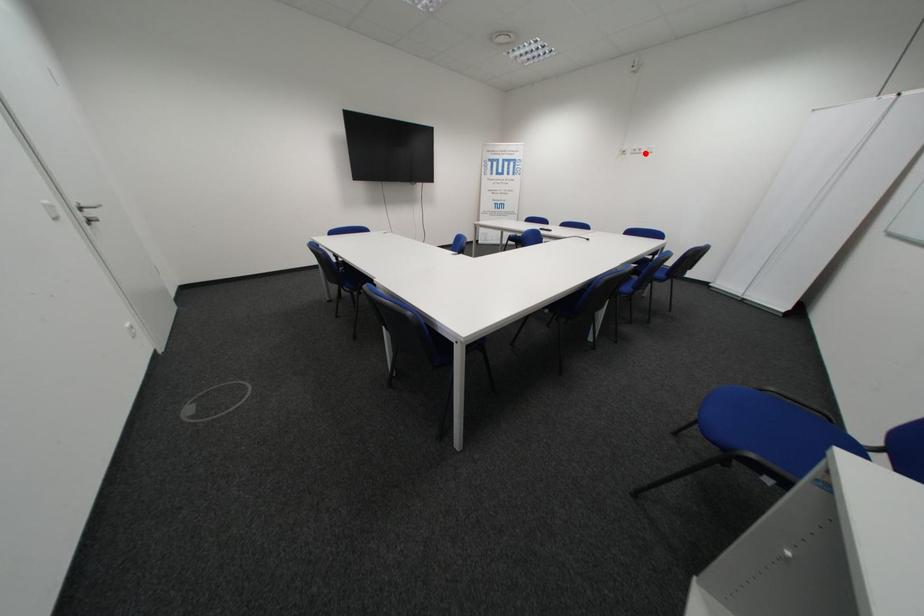
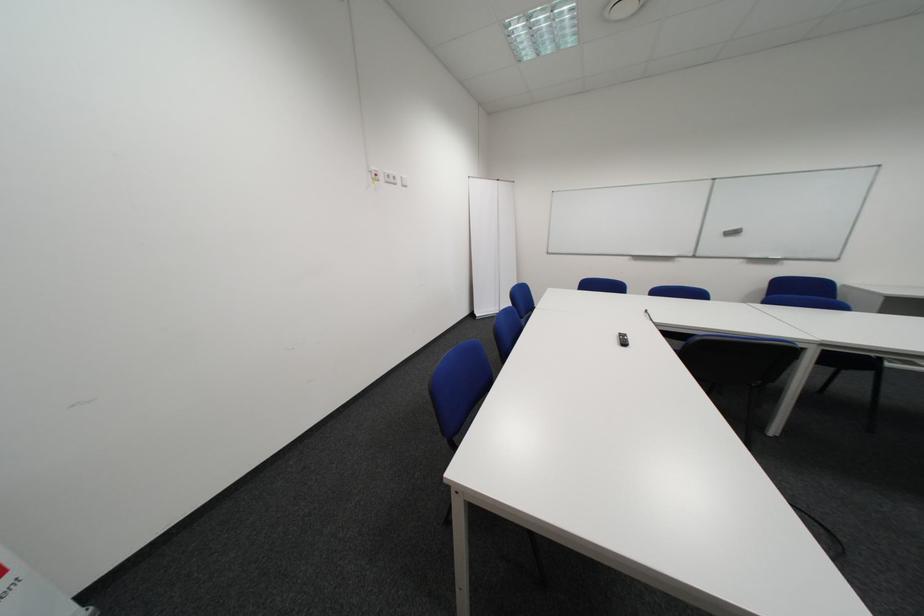
Question: I am providing you with two images of the same scene from different viewpoints. A red point is marked on the first image. Is the red point's position out of view in image 2?

Choices:
 (A) Yes
 (B) No

Answer: (B)